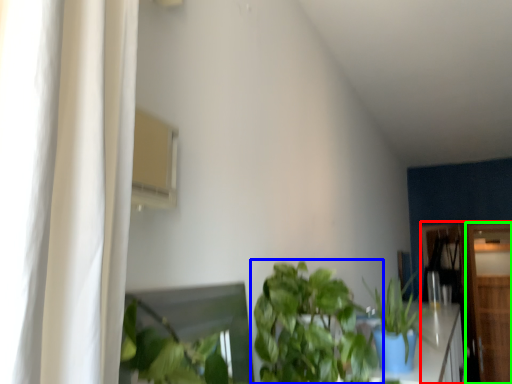
Question: Which object is the closest to the dresser (highlighted by a red box)? Choose among these: houseplant (highlighted by a blue box) or dresser (highlighted by a green box).

Choices:
 (A) houseplant
 (B) dresser

Answer: (B)